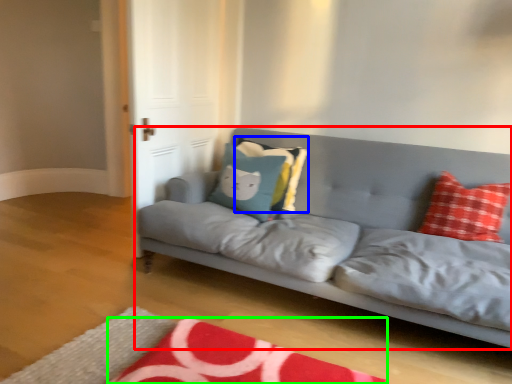
Question: Based on their relative distances, which object is farther from studio couch (highlighted by a red box)? Choose from pillow (highlighted by a blue box) and mat (highlighted by a green box).

Choices:
 (A) pillow
 (B) mat

Answer: (B)